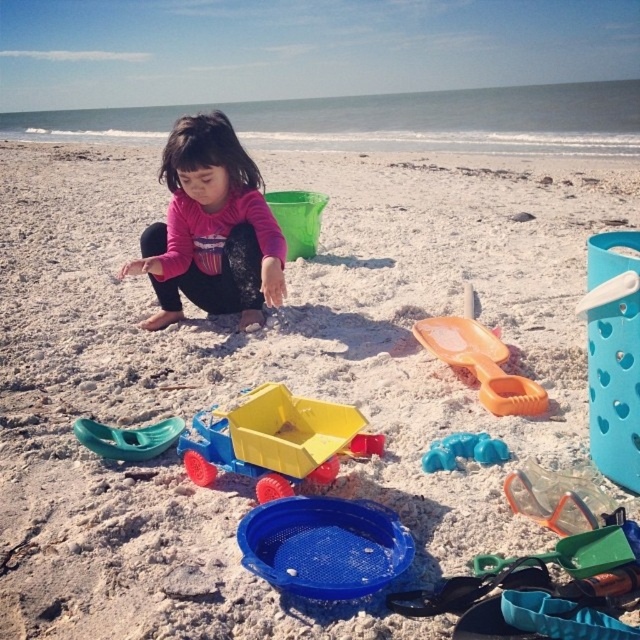
Is blue mesh bucket at center above orange plastic shovel at center?

No, blue mesh bucket at center is not above orange plastic shovel at center.

Can you confirm if blue mesh bucket at center is bigger than orange plastic shovel at center?

No.

Where is `blue mesh bucket at center`? The height and width of the screenshot is (640, 640). blue mesh bucket at center is located at coordinates pos(324,547).

How distant is orange plastic shovel at center from translucent blue plastic toy at center?

orange plastic shovel at center and translucent blue plastic toy at center are 15.75 inches apart.

Which is above, orange plastic shovel at center or translucent blue plastic toy at center?

orange plastic shovel at center is higher up.

What do you see at coordinates (481, 364) in the screenshot?
I see `orange plastic shovel at center` at bounding box center [481, 364].

Where is `orange plastic shovel at center`? The image size is (640, 640). orange plastic shovel at center is located at coordinates (481, 364).

Is the position of pink fabric child at center less distant than that of teal plastic shovel at lower left?

No.

Does point (202, 243) come in front of point (131, 436)?

No, it is not.

Between point (168, 141) and point (150, 438), which one is positioned in front?

Positioned in front is point (150, 438).

Locate an element on the screen. pink fabric child at center is located at coordinates (211, 228).